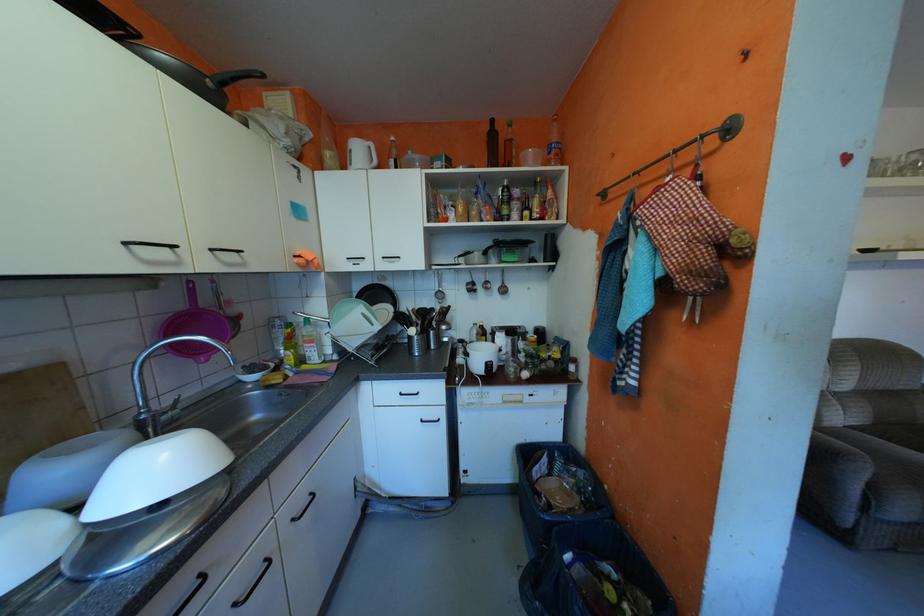
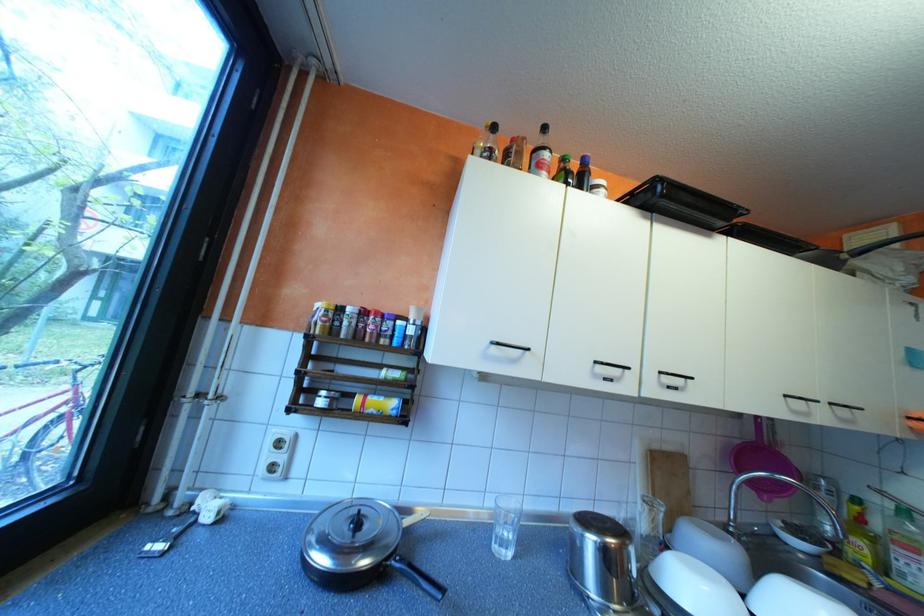
Locate, in the second image, the point that corresponds to point 161,410 in the first image.

(747, 525)